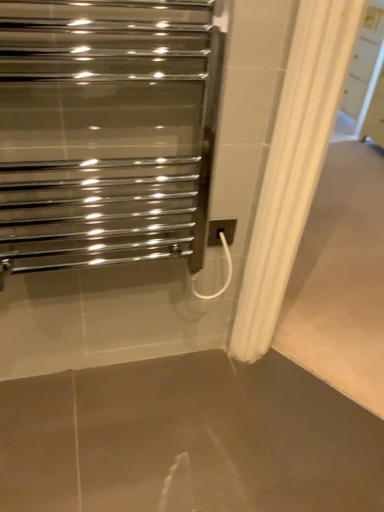
Describe the element at coordinates (100, 130) in the screenshot. This screenshot has width=384, height=512. I see `polished chrome towel warmer at upper left` at that location.

Where is `brown polished concrete at center`? brown polished concrete at center is located at coordinates (187, 439).

Locate an element on the screen. white plastic electric outlet at center-right is located at coordinates (221, 231).

Is the position of white plastic electric outlet at center-right less distant than that of brown polished concrete at center?

No, white plastic electric outlet at center-right is behind brown polished concrete at center.

Is white plastic electric outlet at center-right wider or thinner than brown polished concrete at center?

In the image, white plastic electric outlet at center-right appears to be more narrow than brown polished concrete at center.

Which is nearer, (x=209, y=238) or (x=304, y=506)?

Point (x=209, y=238) is farther from the camera than point (x=304, y=506).

What are the coordinates of `concrete on the right of white plastic electric outlet at center-right` in the screenshot? It's located at (187, 439).

From a real-world perspective, is brown polished concrete at center under white plastic electric outlet at center-right?

Correct, in the physical world, brown polished concrete at center is lower than white plastic electric outlet at center-right.

Which is closer, (36, 477) or (227, 238)?

Positioned in front is point (36, 477).

From the image's perspective, is brown polished concrete at center beneath white plastic electric outlet at center-right?

Correct, brown polished concrete at center appears lower than white plastic electric outlet at center-right in the image.

Is brown polished concrete at center inside or outside of white plastic electric outlet at center-right?

brown polished concrete at center is outside white plastic electric outlet at center-right.

What's the angular difference between polished chrome towel warmer at upper left and brown polished concrete at center's facing directions?

The angular difference between polished chrome towel warmer at upper left and brown polished concrete at center is 90.1 degrees.

In the scene shown: From a real-world perspective, which object rests below the other?

From a 3D spatial view, brown polished concrete at center is below.

The height and width of the screenshot is (512, 384). Identify the location of concrete behind the polished chrome towel warmer at upper left. (187, 439).

Which of these two, polished chrome towel warmer at upper left or brown polished concrete at center, is thinner?

Thinner between the two is polished chrome towel warmer at upper left.

Considering the relative positions of polished chrome towel warmer at upper left and white plastic electric outlet at center-right in the image provided, is polished chrome towel warmer at upper left to the left or to the right of white plastic electric outlet at center-right?

polished chrome towel warmer at upper left is to the left of white plastic electric outlet at center-right.

From a real-world perspective, is polished chrome towel warmer at upper left below white plastic electric outlet at center-right?

Actually, polished chrome towel warmer at upper left is physically above white plastic electric outlet at center-right in the real world.

Is polished chrome towel warmer at upper left wider than white plastic electric outlet at center-right?

Yes.

From the image's perspective, does polished chrome towel warmer at upper left appear lower than white plastic electric outlet at center-right?

No.

Between brown polished concrete at center and polished chrome towel warmer at upper left, which one has smaller size?

brown polished concrete at center.

From a real-world perspective, is brown polished concrete at center positioned above or below polished chrome towel warmer at upper left?

brown polished concrete at center is below polished chrome towel warmer at upper left.

From the image's perspective, who appears lower, brown polished concrete at center or polished chrome towel warmer at upper left?

brown polished concrete at center, from the image's perspective.

What's the angular difference between brown polished concrete at center and polished chrome towel warmer at upper left's facing directions?

90.1 degrees.

From a real-world perspective, does white plastic electric outlet at center-right sit lower than polished chrome towel warmer at upper left?

Indeed, from a real-world perspective, white plastic electric outlet at center-right is positioned beneath polished chrome towel warmer at upper left.

Which is behind, white plastic electric outlet at center-right or polished chrome towel warmer at upper left?

Positioned behind is white plastic electric outlet at center-right.

How many degrees apart are the facing directions of white plastic electric outlet at center-right and polished chrome towel warmer at upper left?

They differ by 0.0641 degrees in their facing directions.

Which is behind, point (228, 229) or point (116, 170)?

The point (228, 229) is farther from the camera.

Locate an element on the screen. This screenshot has width=384, height=512. electric outlet above the brown polished concrete at center (from a real-world perspective) is located at coordinates (221, 231).

Locate an element on the screen. electric outlet above the brown polished concrete at center (from the image's perspective) is located at coordinates (221, 231).

Looking at the image, which one is located further to white plastic electric outlet at center-right, polished chrome towel warmer at upper left or brown polished concrete at center?

Based on the image, brown polished concrete at center appears to be further to white plastic electric outlet at center-right.

Which object lies nearer to the anchor point brown polished concrete at center, white plastic electric outlet at center-right or polished chrome towel warmer at upper left?

white plastic electric outlet at center-right.

Which object lies nearer to the anchor point white plastic electric outlet at center-right, brown polished concrete at center or polished chrome towel warmer at upper left?

The object closer to white plastic electric outlet at center-right is polished chrome towel warmer at upper left.

Based on the photo, when comparing their distances from brown polished concrete at center, does polished chrome towel warmer at upper left or white plastic electric outlet at center-right seem closer?

white plastic electric outlet at center-right is positioned closer to the anchor brown polished concrete at center.

From the image, which object appears to be nearer to polished chrome towel warmer at upper left, white plastic electric outlet at center-right or brown polished concrete at center?

Based on the image, white plastic electric outlet at center-right appears to be nearer to polished chrome towel warmer at upper left.

Looking at the image, which one is located closer to polished chrome towel warmer at upper left, brown polished concrete at center or white plastic electric outlet at center-right?

white plastic electric outlet at center-right.

Locate an element on the screen. This screenshot has height=512, width=384. electric outlet that lies between polished chrome towel warmer at upper left and brown polished concrete at center from top to bottom is located at coordinates (221, 231).